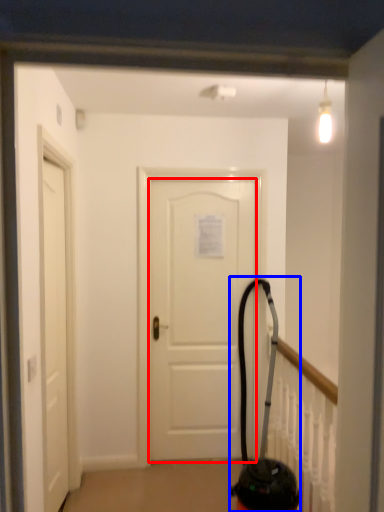
Question: Among these objects, which one is farthest to the camera, door (highlighted by a red box) or extinguisher (highlighted by a blue box)?

Choices:
 (A) door
 (B) extinguisher

Answer: (A)